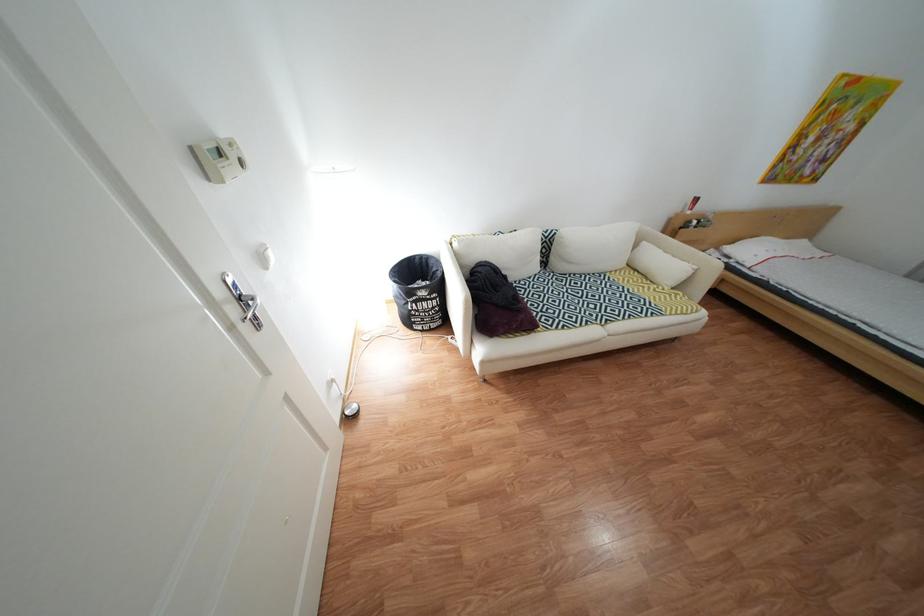
What do you see at coordinates (496, 302) in the screenshot? Image resolution: width=924 pixels, height=616 pixels. I see `the purple pillow` at bounding box center [496, 302].